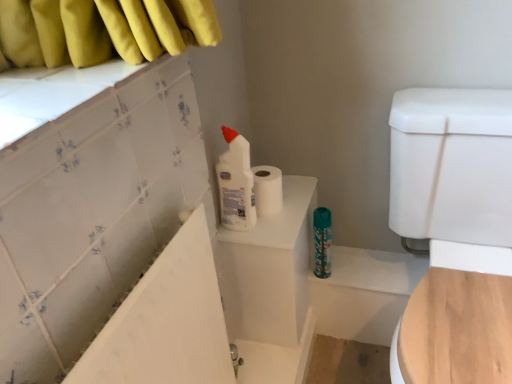
Question: Is white glossy toilet bowl at right at the left side of white plastic bottle at upper center?

Choices:
 (A) yes
 (B) no

Answer: (B)

Question: Is white plastic bottle at upper center surrounded by white glossy toilet bowl at right?

Choices:
 (A) yes
 (B) no

Answer: (B)

Question: From a real-world perspective, is white glossy toilet bowl at right positioned under white plastic bottle at upper center based on gravity?

Choices:
 (A) yes
 (B) no

Answer: (A)

Question: Does white glossy toilet bowl at right have a smaller size compared to white plastic bottle at upper center?

Choices:
 (A) yes
 (B) no

Answer: (B)

Question: From the image's perspective, is white glossy toilet bowl at right under white plastic bottle at upper center?

Choices:
 (A) yes
 (B) no

Answer: (A)

Question: From the image's perspective, does white glossy toilet bowl at right appear higher than white plastic bottle at upper center?

Choices:
 (A) no
 (B) yes

Answer: (A)

Question: Does white glossy toilet bowl at right have a larger size compared to teal glossy water bottle at center?

Choices:
 (A) yes
 (B) no

Answer: (A)

Question: Does white glossy toilet bowl at right touch teal glossy water bottle at center?

Choices:
 (A) no
 (B) yes

Answer: (A)

Question: From a real-world perspective, is white glossy toilet bowl at right positioned under teal glossy water bottle at center based on gravity?

Choices:
 (A) yes
 (B) no

Answer: (B)

Question: Can you confirm if white glossy toilet bowl at right is thinner than teal glossy water bottle at center?

Choices:
 (A) yes
 (B) no

Answer: (B)

Question: Is white glossy toilet bowl at right far from teal glossy water bottle at center?

Choices:
 (A) yes
 (B) no

Answer: (B)

Question: Is the position of white glossy toilet bowl at right more distant than that of teal glossy water bottle at center?

Choices:
 (A) yes
 (B) no

Answer: (B)

Question: Are white matte toilet paper at upper center and teal glossy water bottle at center far apart?

Choices:
 (A) yes
 (B) no

Answer: (B)